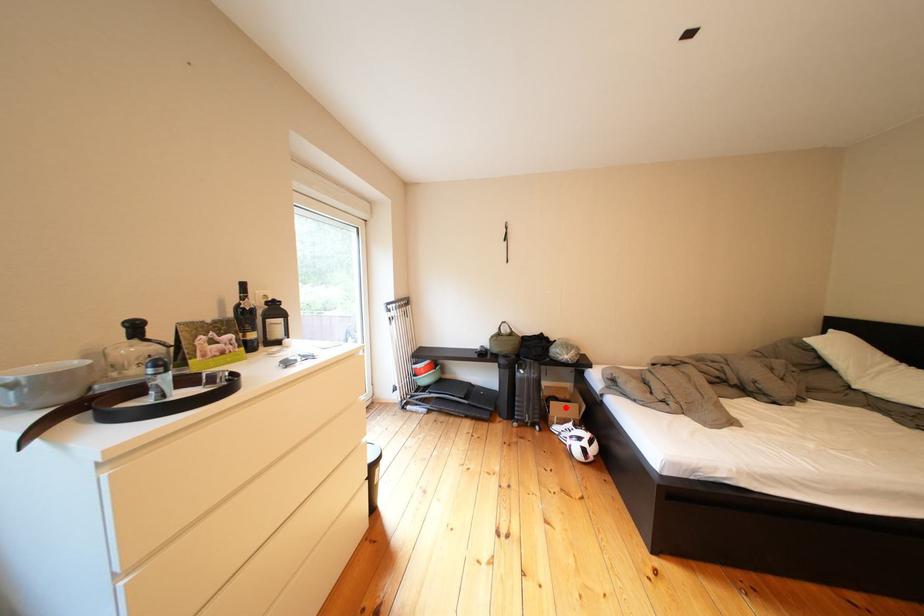
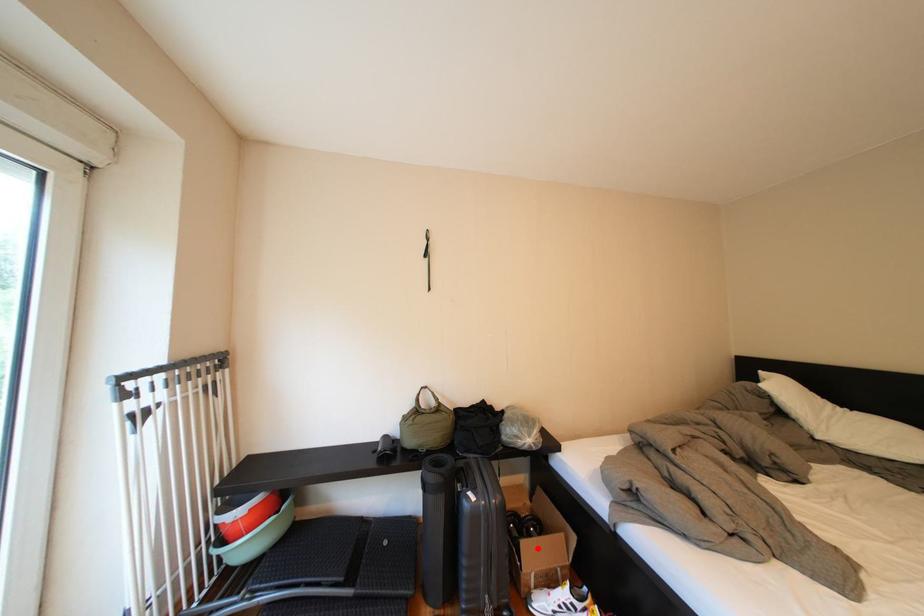
I am providing you with two images of the same scene from different viewpoints. A red point is marked on the first image and another point is marked on the second image. Is the red point in image1 aligned with the point shown in image2?

Yes